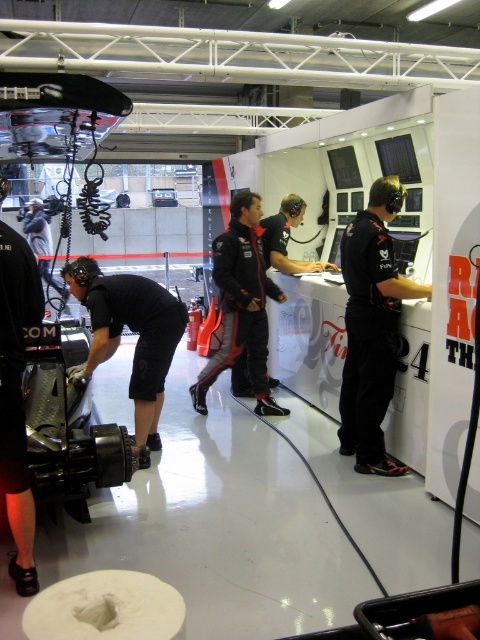
Question: Does black matte suit at right have a lesser width compared to black matte mechanic at lower left?

Choices:
 (A) no
 (B) yes

Answer: (B)

Question: Which of these objects is positioned farthest from the black matte suit at right?

Choices:
 (A) black matte suit at center
 (B) black matte mechanic at lower left

Answer: (B)

Question: Based on their relative distances, which object is farther from the black matte suit at right?

Choices:
 (A) black matte suit at center
 (B) black matte mechanic at lower left

Answer: (B)

Question: Does black matte suit at right appear on the right side of black matte suit at center?

Choices:
 (A) yes
 (B) no

Answer: (A)

Question: Can you confirm if black matte mechanic at lower left is thinner than black matte suit at center?

Choices:
 (A) yes
 (B) no

Answer: (A)

Question: Among these points, which one is farthest from the camera?

Choices:
 (A) (381, 221)
 (B) (277, 288)
 (C) (119, 300)

Answer: (B)